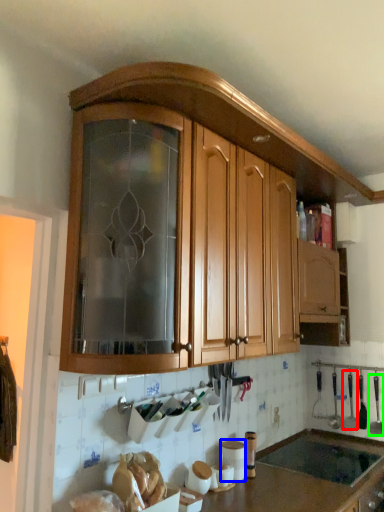
Question: Which is nearer to the silverware (highlighted by a red box)? appliance (highlighted by a blue box) or silverware (highlighted by a green box).

Choices:
 (A) appliance
 (B) silverware

Answer: (B)